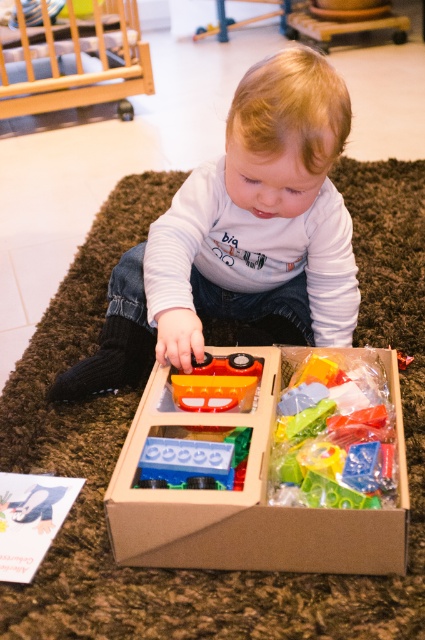
You are helping a child organize their play area. You see the brown cardboard box at center and the translucent plastic toy at center. Which object should you place first in the storage bin if you need to prioritize the larger item?

The brown cardboard box at center is larger than the translucent plastic toy at center, so you should place the brown cardboard box at center first to prioritize the larger item.

You are a parent trying to organize the child play area. You have a small storage bin that can only fit items up to 10 inches wide. You see the translucent plastic toy at center and the translucent orange plastic toy car at center. Which one can fit in the bin?

The translucent plastic toy at center is larger in width than the translucent orange plastic toy car at center. Therefore, the translucent orange plastic toy car at center can fit in the storage bin since it is smaller than 10 inches wide.

You are a parent trying to help your child find their favorite toy. You see the translucent plastic toy at center and the translucent orange plastic toy car at center. Which toy is located to the right of the other?

The translucent plastic toy at center is to the right of the translucent orange plastic toy car at center.